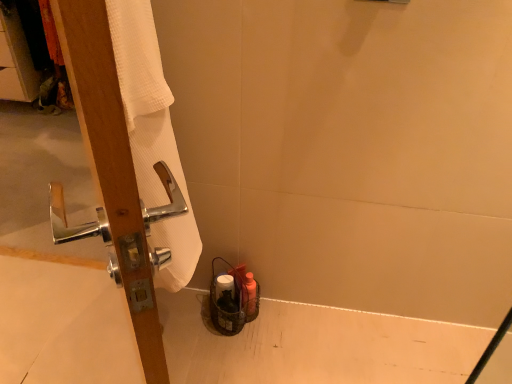
The image size is (512, 384). What do you see at coordinates (110, 155) in the screenshot?
I see `wooden screen door at left` at bounding box center [110, 155].

Image resolution: width=512 pixels, height=384 pixels. What are the coordinates of `wooden screen door at left` in the screenshot? It's located at (110, 155).

What is the approximate width of wooden screen door at left?

wooden screen door at left is 3.09 inches wide.

In order to click on wooden screen door at left in this screenshot , I will do `click(110, 155)`.